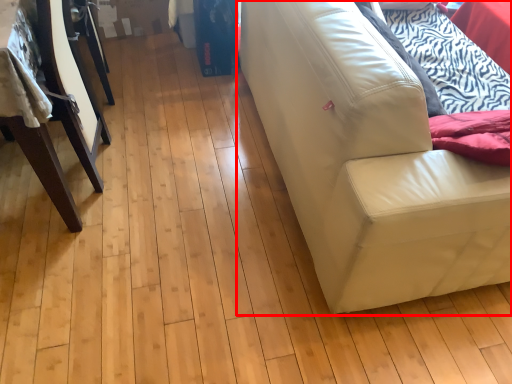
Question: Considering the relative positions of studio couch (annotated by the red box) and furniture in the image provided, where is studio couch (annotated by the red box) located with respect to the staircase?

Choices:
 (A) right
 (B) left

Answer: (A)